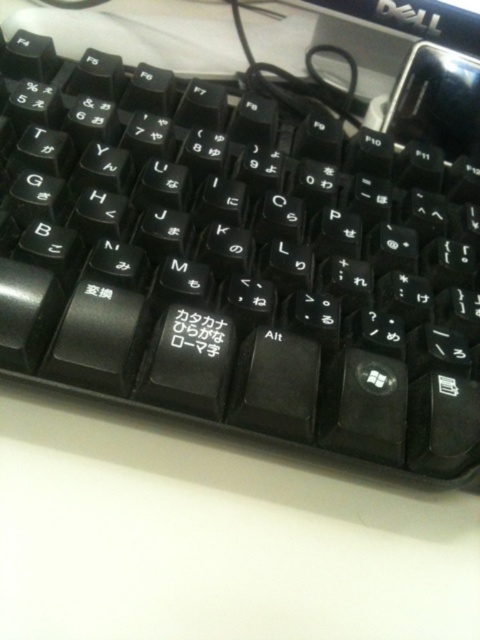
Can you confirm if black plastic keyboard at center is positioned below black plastic logo at upper center?

Yes.

Is black plastic keyboard at center further to the viewer compared to black plastic logo at upper center?

That is False.

Where is `black plastic keyboard at center`? black plastic keyboard at center is located at coordinates (238, 259).

Does black plastic keyboard at center appear over black matte text at center?

Indeed, black plastic keyboard at center is positioned over black matte text at center.

Between point (24, 326) and point (175, 308), which one is positioned in front?

Point (24, 326) is more forward.

Does point (269, 364) come farther from viewer compared to point (181, 314)?

No.

Identify the location of black plastic keyboard at center. (238, 259).

This screenshot has height=640, width=480. What do you see at coordinates (196, 333) in the screenshot?
I see `black matte text at center` at bounding box center [196, 333].

Which is in front, point (226, 349) or point (396, 4)?

Point (226, 349)

Where is `black matte text at center`? black matte text at center is located at coordinates (196, 333).